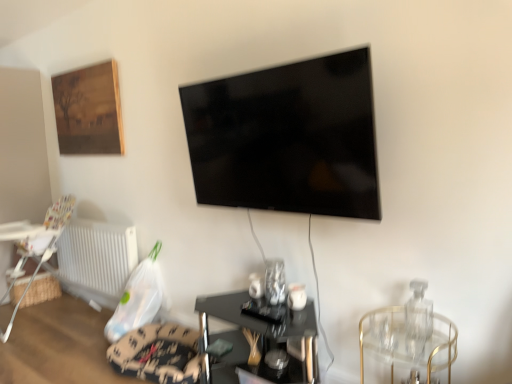
The height and width of the screenshot is (384, 512). Identify the location of free spot above wooden framed painting at upper left (from a real-world perspective). (78, 70).